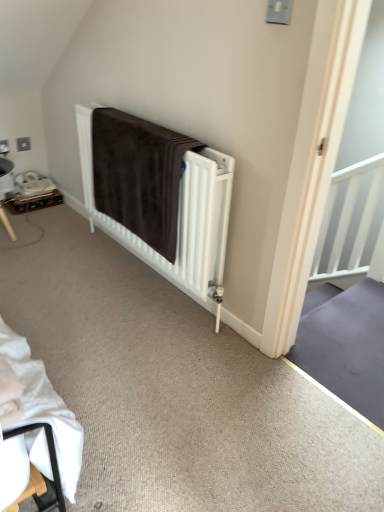
Question: Does wooden tray at left have a lesser height compared to brown plush blanket at center?

Choices:
 (A) yes
 (B) no

Answer: (A)

Question: Is wooden tray at left closer to the viewer compared to brown plush blanket at center?

Choices:
 (A) yes
 (B) no

Answer: (B)

Question: Can you confirm if wooden tray at left is positioned to the right of brown plush blanket at center?

Choices:
 (A) no
 (B) yes

Answer: (A)

Question: Is wooden tray at left looking in the opposite direction of brown plush blanket at center?

Choices:
 (A) yes
 (B) no

Answer: (B)

Question: Is wooden tray at left bigger than brown plush blanket at center?

Choices:
 (A) yes
 (B) no

Answer: (B)

Question: Is brown fabric bed at center to the left or to the right of brown plush blanket at center in the image?

Choices:
 (A) left
 (B) right

Answer: (A)

Question: Looking at the image, does brown fabric bed at center seem bigger or smaller compared to brown plush blanket at center?

Choices:
 (A) big
 (B) small

Answer: (A)

Question: From a real-world perspective, is brown fabric bed at center physically located above or below brown plush blanket at center?

Choices:
 (A) below
 (B) above

Answer: (A)

Question: Relative to brown plush blanket at center, is brown fabric bed at center in front or behind?

Choices:
 (A) front
 (B) behind

Answer: (A)

Question: Considering the positions of wooden tray at left and brown fabric bed at center in the image, is wooden tray at left taller or shorter than brown fabric bed at center?

Choices:
 (A) short
 (B) tall

Answer: (A)

Question: Considering their positions, is wooden tray at left located in front of or behind brown fabric bed at center?

Choices:
 (A) front
 (B) behind

Answer: (B)

Question: Considering the positions of wooden tray at left and brown fabric bed at center in the image, is wooden tray at left wider or thinner than brown fabric bed at center?

Choices:
 (A) thin
 (B) wide

Answer: (B)

Question: Is wooden tray at left to the left or to the right of brown fabric bed at center in the image?

Choices:
 (A) right
 (B) left

Answer: (B)

Question: From a real-world perspective, is wooden tray at left physically located above or below brown plush blanket at center?

Choices:
 (A) above
 (B) below

Answer: (B)

Question: Is wooden tray at left bigger or smaller than brown plush blanket at center?

Choices:
 (A) small
 (B) big

Answer: (A)